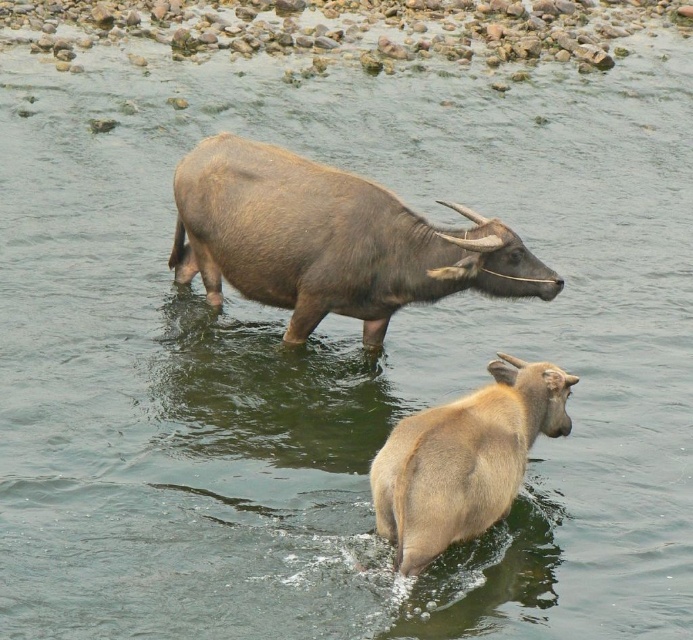
Question: Is brown matte bison at center below light brown matte yak at center?

Choices:
 (A) no
 (B) yes

Answer: (A)

Question: Among these points, which one is farthest from the camera?

Choices:
 (A) (182, 212)
 (B) (437, 438)

Answer: (A)

Question: Which point is farther to the camera?

Choices:
 (A) (389, 465)
 (B) (315, 310)

Answer: (B)

Question: In this image, where is brown matte bison at center located relative to light brown matte yak at center?

Choices:
 (A) below
 (B) above

Answer: (B)

Question: Among these points, which one is nearest to the camera?

Choices:
 (A) (529, 272)
 (B) (392, 440)

Answer: (B)

Question: Considering the relative positions of brown matte bison at center and light brown matte yak at center in the image provided, where is brown matte bison at center located with respect to light brown matte yak at center?

Choices:
 (A) right
 (B) left

Answer: (B)